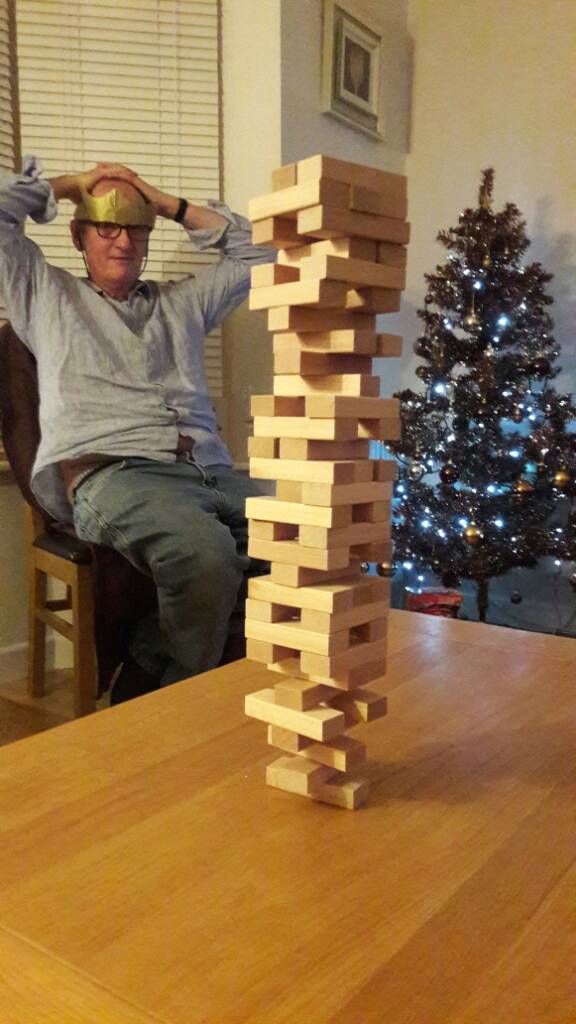
Find the location of a particular element. chair legs is located at coordinates (33, 622), (83, 624).